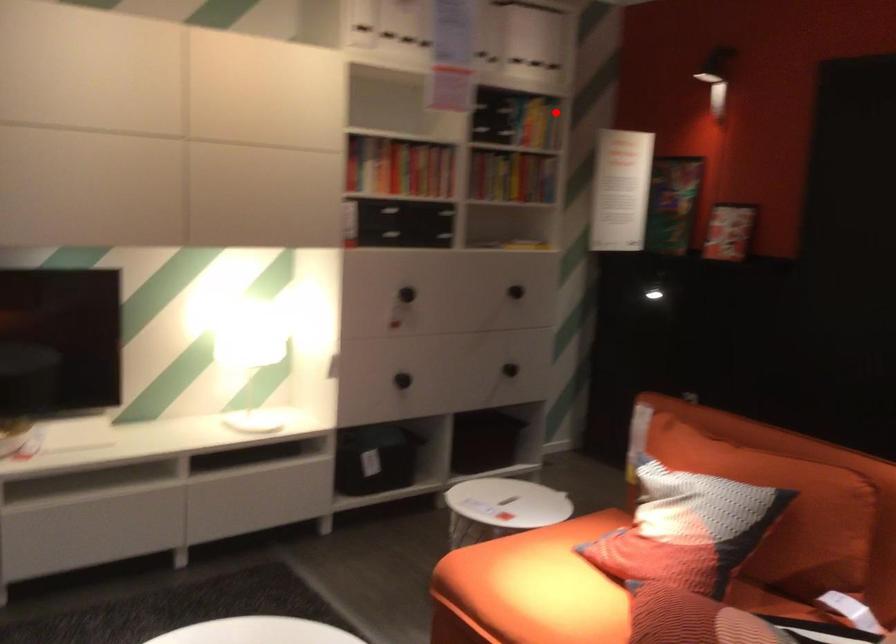
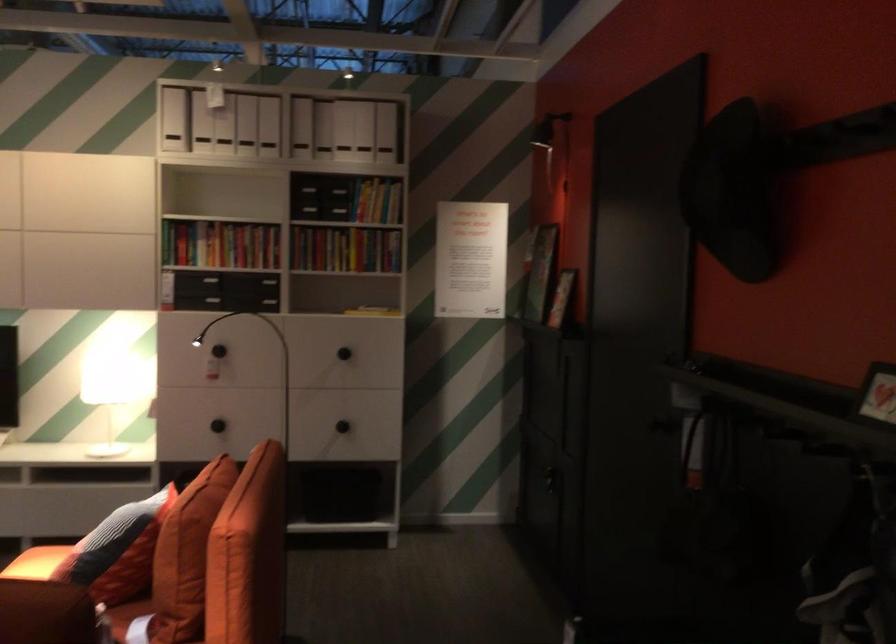
Find the pixel in the second image that matches the highlighted location in the first image.

(376, 201)